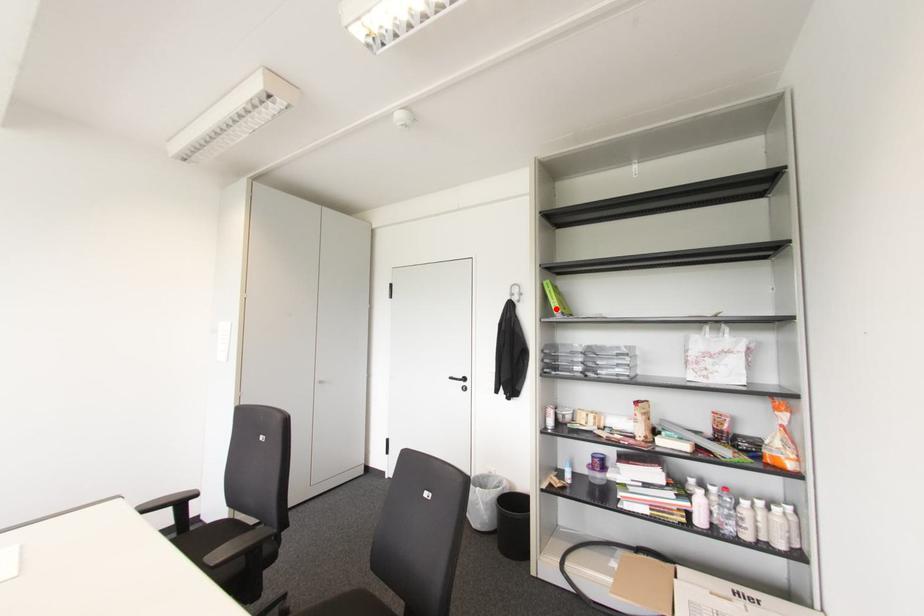
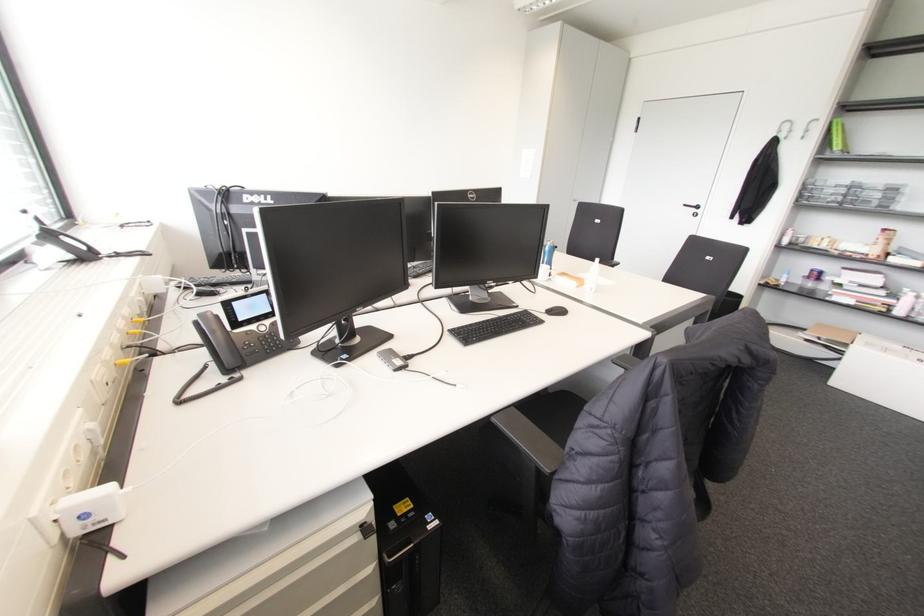
Locate, in the second image, the point that corresponds to the highlighted location in the first image.

(836, 147)